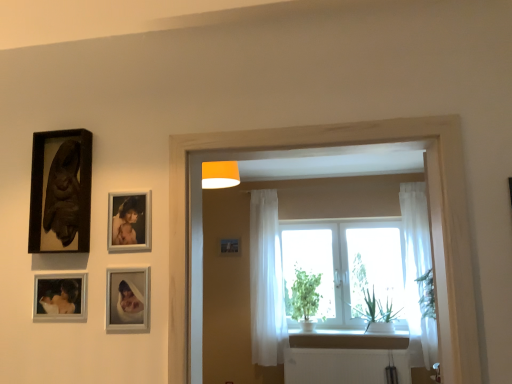
Question: In which direction should I rotate to look at green leafy plant at window, the second plant positioned from the left?

Choices:
 (A) right
 (B) left

Answer: (A)

Question: Does white sheer curtain at center, placed as the 1th curtain when sorted from left to right, appear on the right side of white sheer curtain at right, positioned as the second curtain in left-to-right order?

Choices:
 (A) yes
 (B) no

Answer: (B)

Question: From a real-world perspective, is white sheer curtain at center, placed as the 2th curtain when sorted from right to left, on top of white sheer curtain at right, arranged as the first curtain when viewed from the right?

Choices:
 (A) yes
 (B) no

Answer: (A)

Question: Is white sheer curtain at center, placed as the 1th curtain when sorted from left to right, behind white sheer curtain at right, arranged as the first curtain when viewed from the right?

Choices:
 (A) no
 (B) yes

Answer: (B)

Question: Is white sheer curtain at center, placed as the 2th curtain when sorted from right to left, directly adjacent to white sheer curtain at right, arranged as the first curtain when viewed from the right?

Choices:
 (A) yes
 (B) no

Answer: (B)

Question: From a real-world perspective, is white sheer curtain at center, placed as the 2th curtain when sorted from right to left, physically below white sheer curtain at right, positioned as the second curtain in left-to-right order?

Choices:
 (A) no
 (B) yes

Answer: (A)

Question: Does white sheer curtain at center, placed as the 1th curtain when sorted from left to right, lie in front of white sheer curtain at right, positioned as the second curtain in left-to-right order?

Choices:
 (A) no
 (B) yes

Answer: (A)

Question: Can you confirm if white sheer curtain at center, placed as the 2th curtain when sorted from right to left, is shorter than white matte window frame at center?

Choices:
 (A) yes
 (B) no

Answer: (B)

Question: Is white sheer curtain at center, placed as the 2th curtain when sorted from right to left, positioned behind white matte window frame at center?

Choices:
 (A) yes
 (B) no

Answer: (A)

Question: Is white sheer curtain at center, placed as the 1th curtain when sorted from left to right, positioned before white matte window frame at center?

Choices:
 (A) yes
 (B) no

Answer: (B)

Question: From the image's perspective, is white sheer curtain at center, placed as the 1th curtain when sorted from left to right, on white matte window frame at center?

Choices:
 (A) yes
 (B) no

Answer: (B)

Question: From the image's perspective, is white sheer curtain at center, placed as the 2th curtain when sorted from right to left, under white matte window frame at center?

Choices:
 (A) no
 (B) yes

Answer: (B)

Question: Is white sheer curtain at center, placed as the 2th curtain when sorted from right to left, wider than white matte window frame at center?

Choices:
 (A) no
 (B) yes

Answer: (A)

Question: Is white sheer curtain at center, placed as the 2th curtain when sorted from right to left, not close to matte black picture frame at center?

Choices:
 (A) no
 (B) yes

Answer: (A)